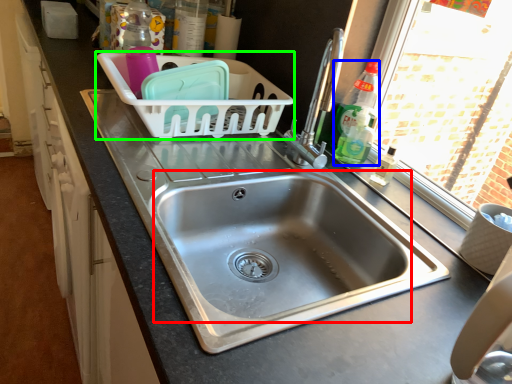
Question: Which object is positioned farthest from sink (highlighted by a red box)? Select from bottle (highlighted by a blue box) and basket (highlighted by a green box).

Choices:
 (A) bottle
 (B) basket

Answer: (B)